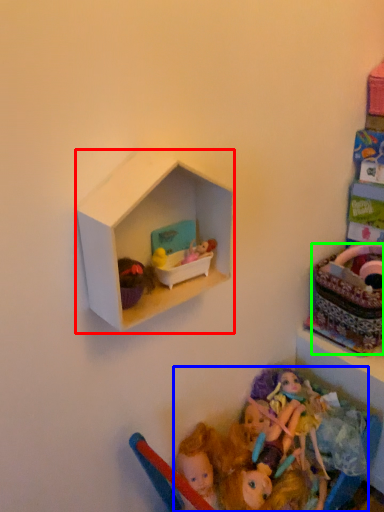
Question: Which object is positioned farthest from shelf (highlighted by a red box)? Select from doll (highlighted by a blue box) and basket (highlighted by a green box).

Choices:
 (A) doll
 (B) basket

Answer: (B)